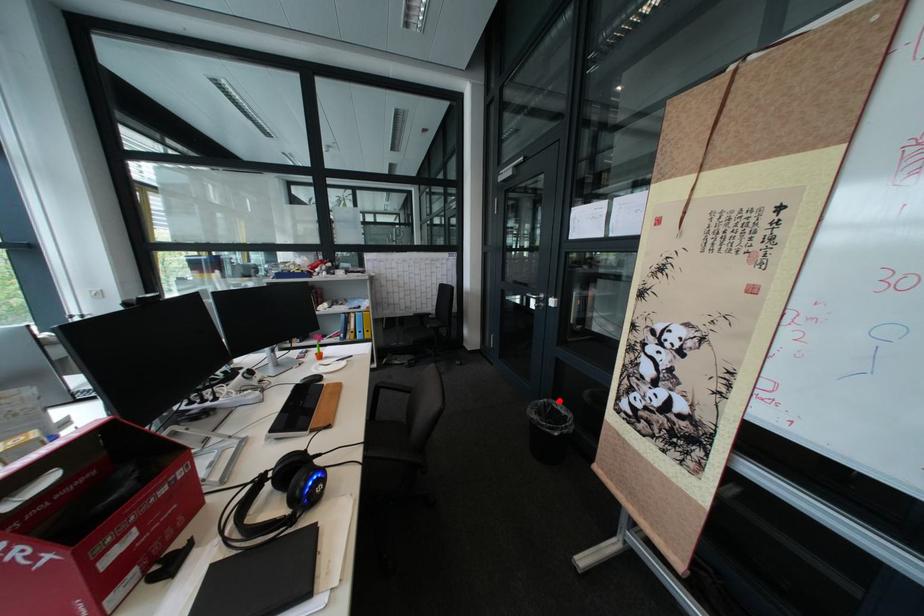
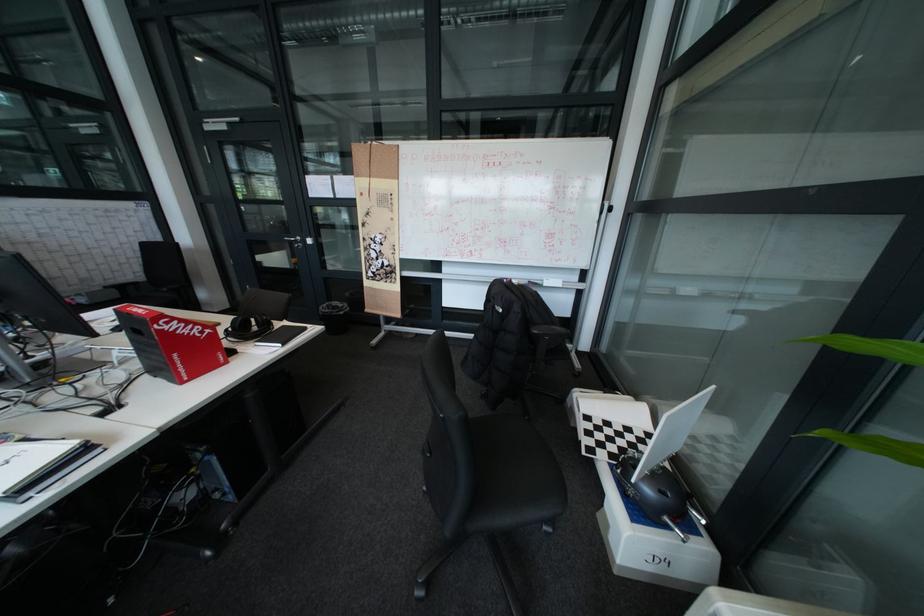
Question: I am providing you with two images of the same scene from different viewpoints. Image1 has a red point marked. In image2, the corresponding 3D location appears at what relative position? Reply with the corresponding letter.

Choices:
 (A) Closer
 (B) Farther

Answer: (B)